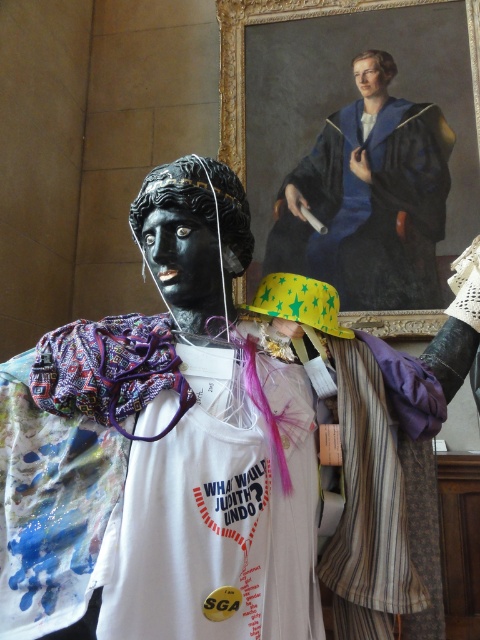
You are an art conservator examining the bust. You need to determine the vertical positioning of the painted fabric tank top at center and the blue velvet robe at upper center. Which one is shorter in height?

The painted fabric tank top at center is shorter in height than the blue velvet robe at upper center because it is not as tall as the robe.

You are an art curator examining the bust and notice the painted fabric tank top at center and the blue velvet robe at upper center. Which of the two items has a smaller width?

The painted fabric tank top at center has a lesser width compared to the blue velvet robe at upper center, so the painted fabric tank top at center has the smaller width.

You are an art conservator examining the bust. You need to clean both the painted fabric tank top at center and the blue velvet robe at upper center. Which one should you start with if you want to work from the closest object to the furthest?

You should start with the painted fabric tank top at center because it is closer to the viewer than the blue velvet robe at upper center.